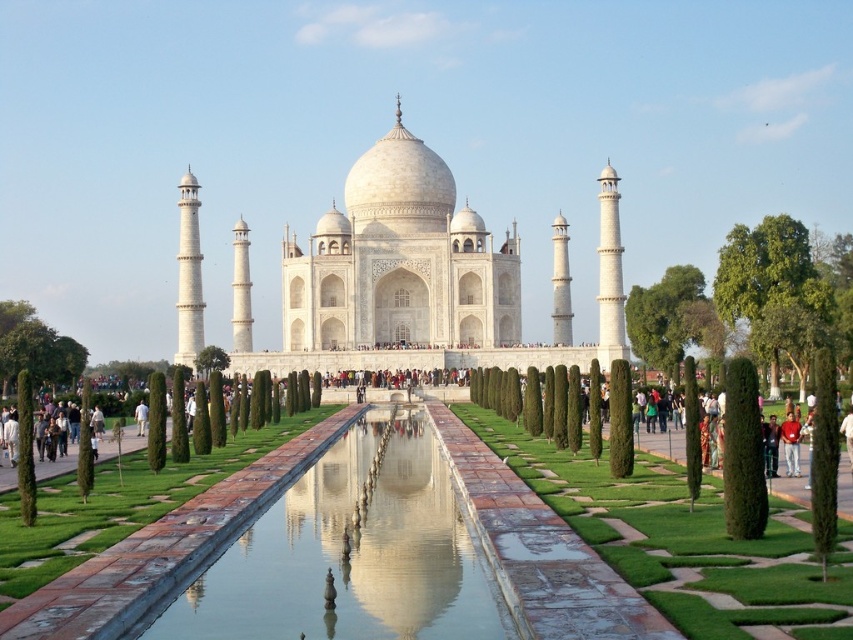
Question: Does white marble taj mahal at center come in front of clear glass water at center?

Choices:
 (A) yes
 (B) no

Answer: (B)

Question: Which point is closer to the camera?

Choices:
 (A) (792, 456)
 (B) (3, 381)

Answer: (A)

Question: Is white marble taj mahal at center bigger than red cotton shirt at center?

Choices:
 (A) no
 (B) yes

Answer: (B)

Question: Where is clear glass water at center located in relation to green leafy tree at center in the image?

Choices:
 (A) left
 (B) right

Answer: (B)

Question: Which point is closer to the camera taking this photo?

Choices:
 (A) (790, 412)
 (B) (54, 365)
 (C) (215, 364)

Answer: (A)

Question: Among these objects, which one is farthest from the camera?

Choices:
 (A) clear glass water at center
 (B) white marble taj mahal at center
 (C) green leafy tree at center
 (D) green leafy tree at upper right

Answer: (D)